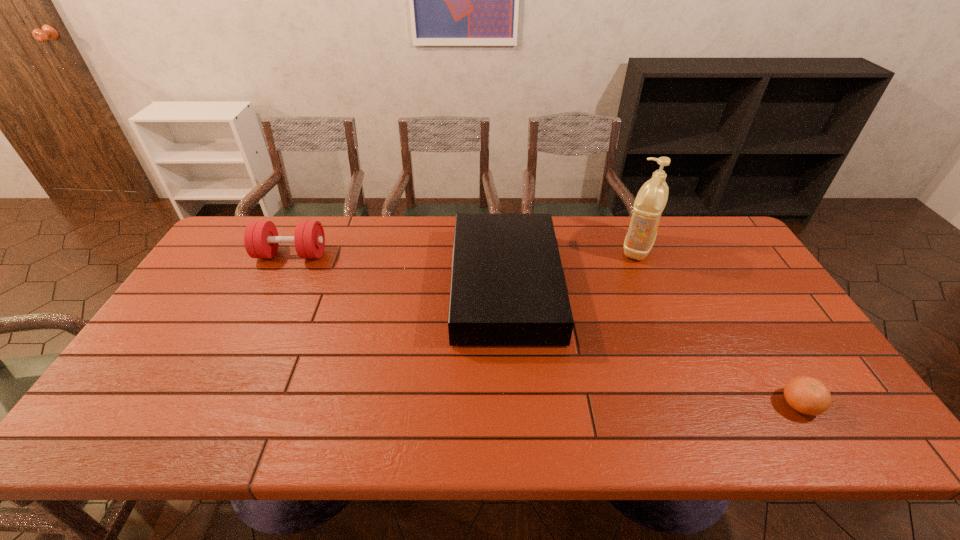
In order to click on free space between the detergent and the clementine in this screenshot , I will do `click(718, 326)`.

Identify the location of vacant area that lies between the CD player and the clementine. (653, 345).

Locate which object is the closest to the second shortest object. Please provide its 2D coordinates. Your answer should be formatted as a tuple, i.e. [(x, y)], where the tuple contains the x and y coordinates of a point satisfying the conditions above.

[(652, 197)]

You are a GUI agent. You are given a task and a screenshot of the screen. Output one action in this format:
    pyautogui.click(x=<x>, y=<y>)
    Task: Click on the object that stands as the closest to the tallest object
    
    Given the screenshot: What is the action you would take?
    pyautogui.click(x=508, y=288)

Find the location of a particular element. This screenshot has width=960, height=540. free space that satisfies the following two spatial constraints: 1. on the front side of the clementine; 2. on the right side of the third shortest object is located at coordinates (216, 404).

Locate an element on the screen. vacant space that satisfies the following two spatial constraints: 1. on the back side of the shortest object; 2. at the front of the second shortest object for disc insertion is located at coordinates (728, 286).

This screenshot has width=960, height=540. I want to click on vacant space that satisfies the following two spatial constraints: 1. at the front of the rightmost object for disc insertion; 2. on the right side of the third tallest object, so click(x=513, y=404).

This screenshot has height=540, width=960. In order to click on vacant point that satisfies the following two spatial constraints: 1. at the front of the CD player for disc insertion; 2. on the left side of the shortest object in this screenshot , I will do `click(513, 404)`.

You are a GUI agent. You are given a task and a screenshot of the screen. Output one action in this format:
    pyautogui.click(x=<x>, y=<y>)
    Task: Click on the vacant area in the image that satisfies the following two spatial constraints: 1. at the front of the CD player for disc insertion; 2. on the back side of the rightmost object
    This screenshot has width=960, height=540.
    Given the screenshot: What is the action you would take?
    pyautogui.click(x=513, y=404)

The width and height of the screenshot is (960, 540). Find the location of `free space that satisfies the following two spatial constraints: 1. on the back side of the tallest object; 2. on the left side of the leftmost object`. free space that satisfies the following two spatial constraints: 1. on the back side of the tallest object; 2. on the left side of the leftmost object is located at coordinates (295, 248).